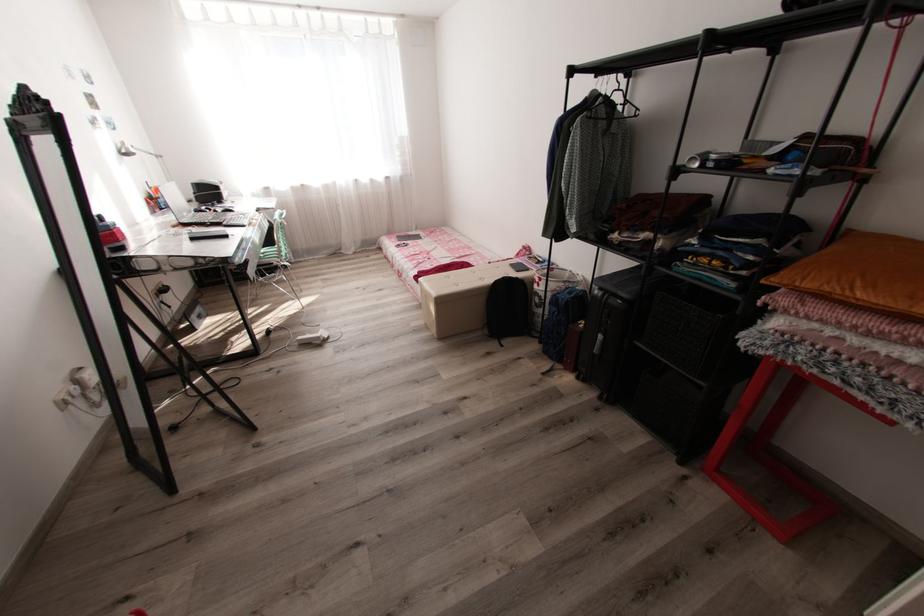
This screenshot has width=924, height=616. Identify the location of beige ottoman lid. [x=455, y=275].